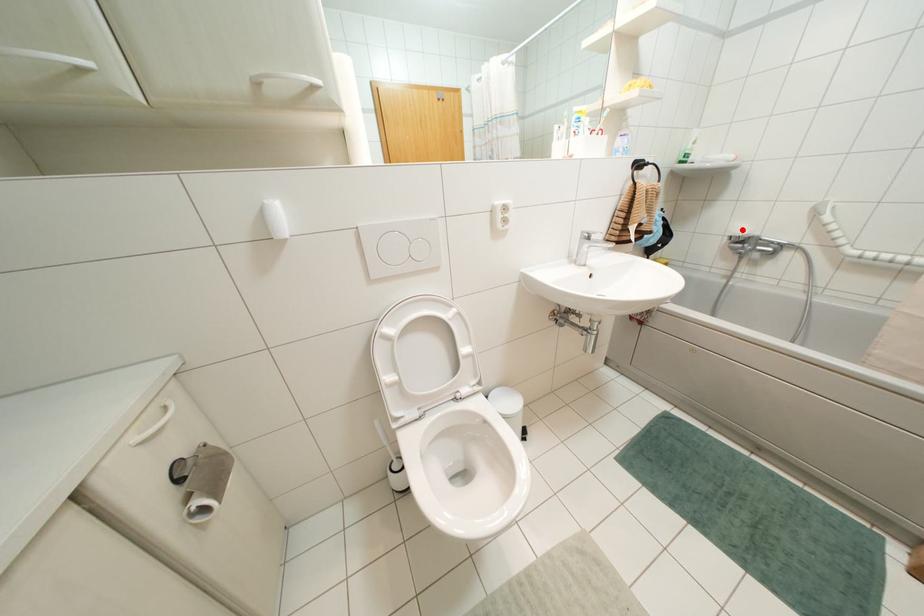
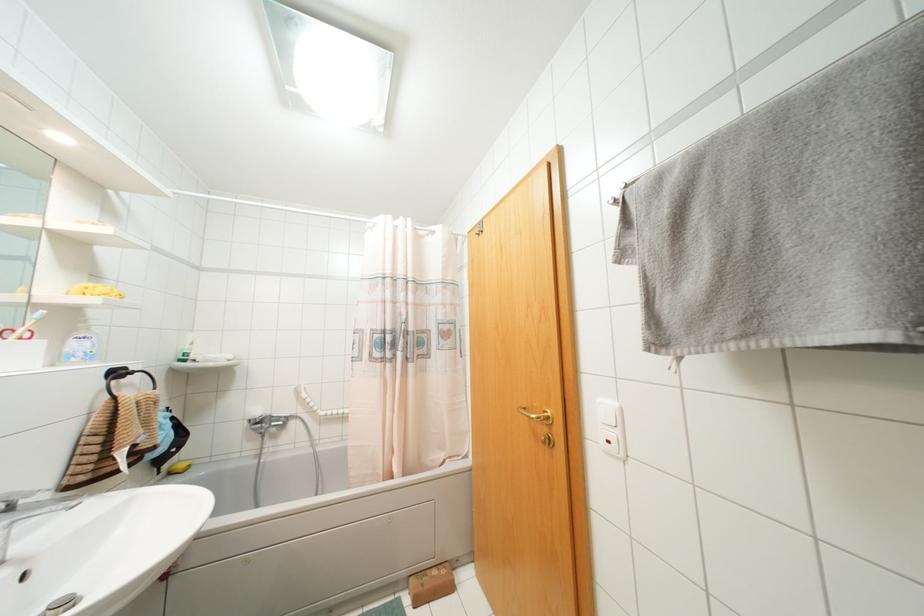
Question: I am providing you with two images of the same scene from different viewpoints. Image1 has a red point marked. In image2, the corresponding 3D location appears at what relative position? Reply with the corresponding letter.

Choices:
 (A) Closer
 (B) Farther

Answer: (B)